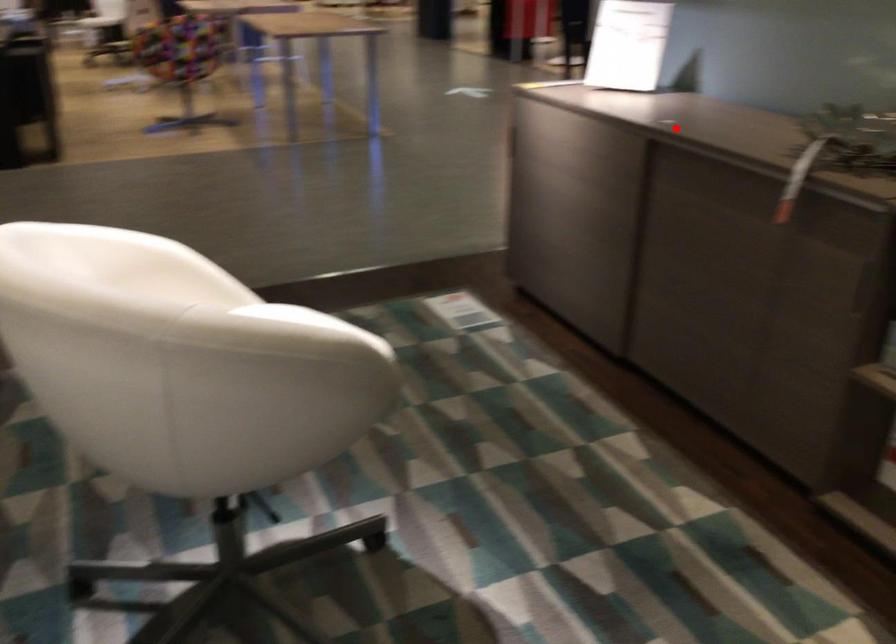
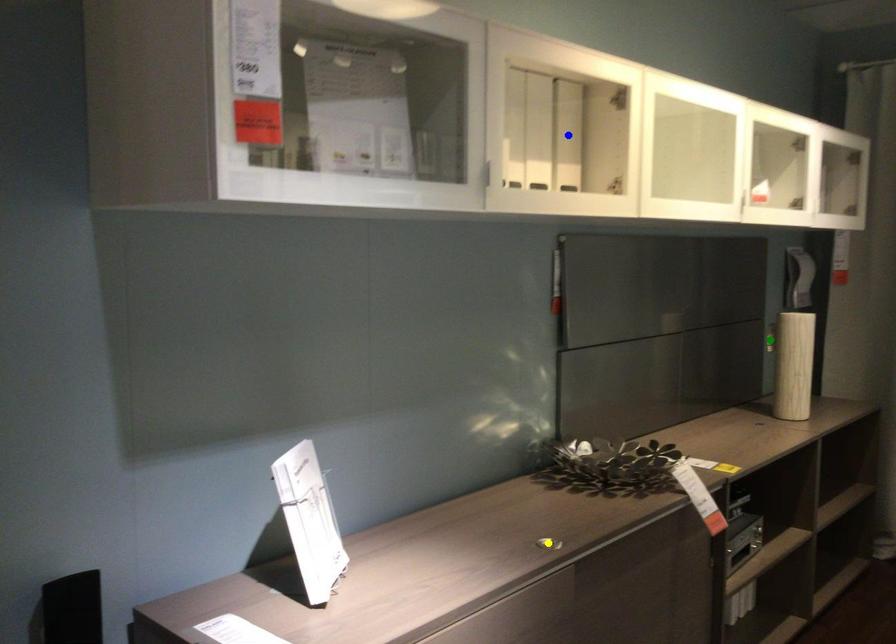
Question: I am providing you with two images of the same scene from different viewpoints. A red point is marked on the first image. You are given multiple points on the second image. Which point in image 2 is actually the same real-world point as the red point in image 1?

Choices:
 (A) yellow point
 (B) blue point
 (C) green point

Answer: (A)